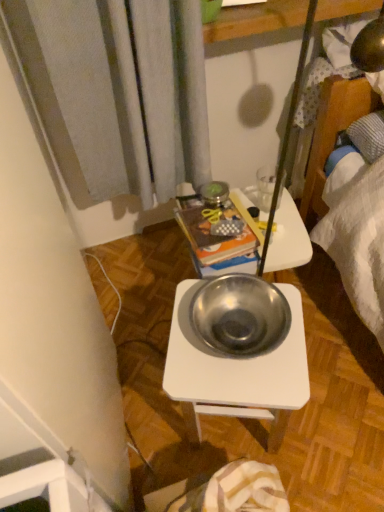
Where is `free space underneath metallic white desk at center (from a real-world perspective)`? Image resolution: width=384 pixels, height=512 pixels. free space underneath metallic white desk at center (from a real-world perspective) is located at coordinates (230, 435).